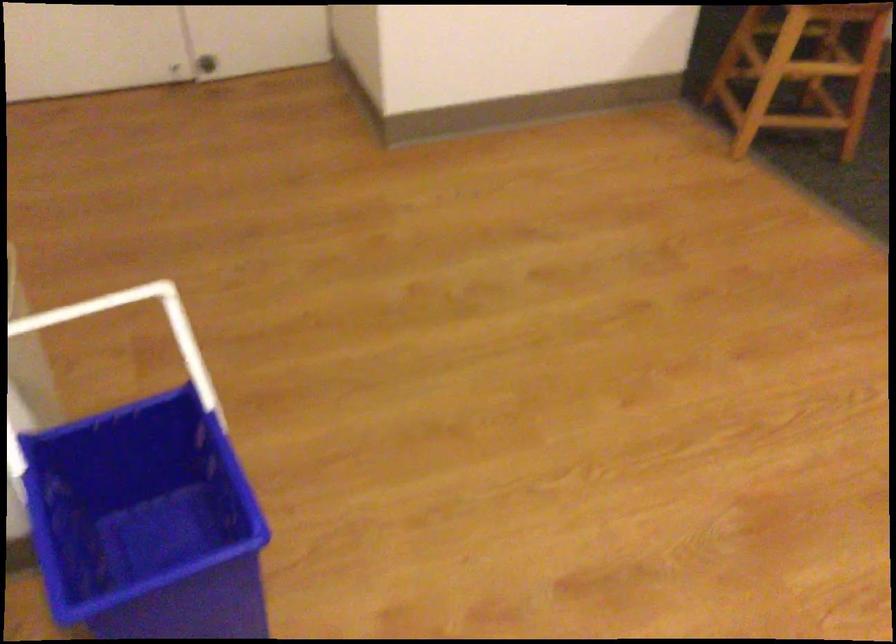
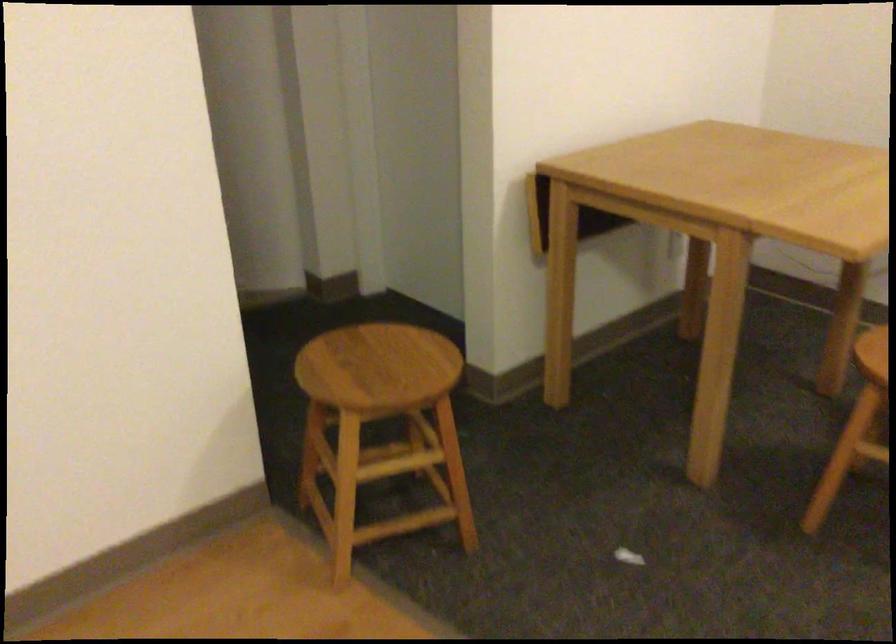
Question: The first image is from the beginning of the video and the second image is from the end. How did the camera likely rotate when shooting the video?

Choices:
 (A) Left
 (B) Right
 (C) Up
 (D) Down

Answer: (B)